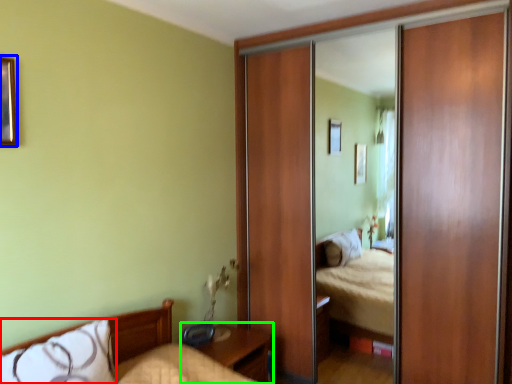
Question: Estimate the real-world distances between objects in this image. Which object is farther from pillow (highlighted by a red box), picture frame (highlighted by a blue box) or nightstand (highlighted by a green box)?

Choices:
 (A) picture frame
 (B) nightstand

Answer: (A)